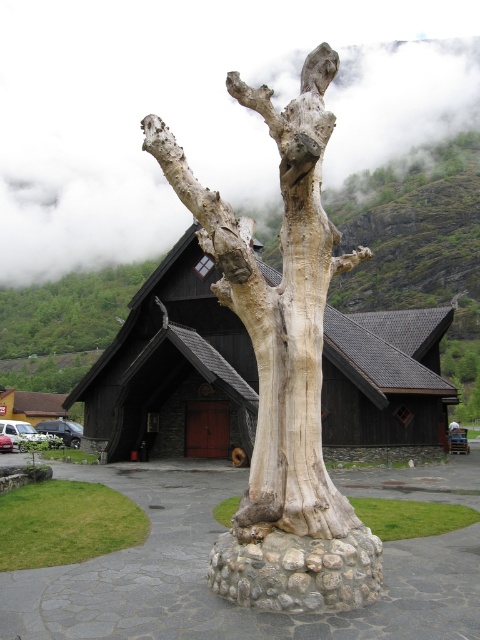
Does point (343, 348) come in front of point (266, 337)?

No.

Is point (218, 312) farther from viewer compared to point (280, 435)?

Yes.

Find the location of a particular element. Image resolution: width=480 pixels, height=640 pixels. dark wood/black shingles at center is located at coordinates (172, 369).

Between light brown wood at center and smooth gray bark at center, which one is positioned higher?

light brown wood at center

Is light brown wood at center smaller than smooth gray bark at center?

Yes, light brown wood at center is smaller than smooth gray bark at center.

Identify the location of light brown wood at center. This screenshot has height=640, width=480. (282, 340).

Between point (210, 326) and point (25, 298), which one is positioned behind?

Point (25, 298)

Can you confirm if dark wood/black shingles at center is positioned to the right of smooth gray bark at upper center?

Correct, you'll find dark wood/black shingles at center to the right of smooth gray bark at upper center.

Find the location of `dark wood/black shingles at center`. dark wood/black shingles at center is located at coordinates pyautogui.click(x=172, y=369).